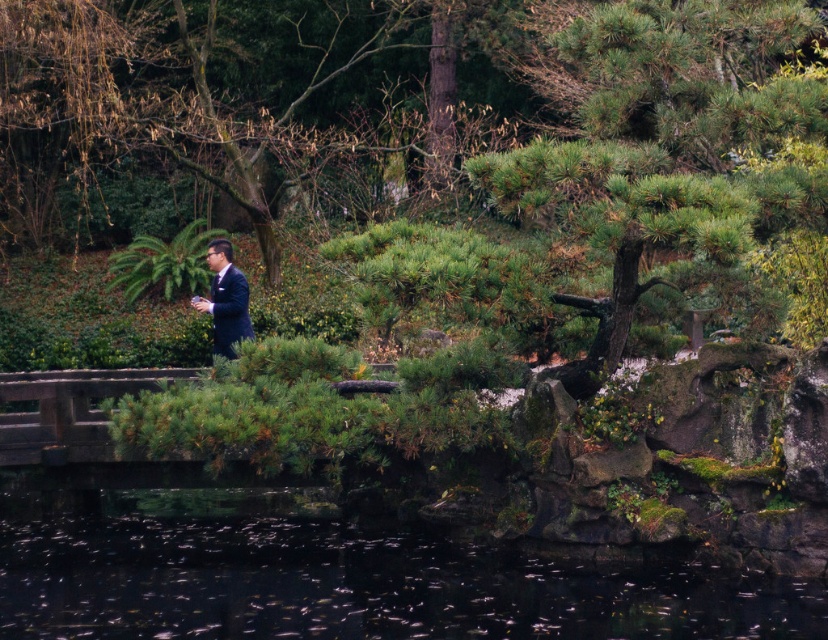
Question: Which object is farther from the camera taking this photo?

Choices:
 (A) matte black suit at center
 (B) transparent water at lower center

Answer: (A)

Question: Is the position of transparent water at lower center more distant than that of matte black suit at center?

Choices:
 (A) no
 (B) yes

Answer: (A)

Question: Is transparent water at lower center wider than matte black suit at center?

Choices:
 (A) no
 (B) yes

Answer: (B)

Question: Which object appears farthest from the camera in this image?

Choices:
 (A) transparent water at lower center
 (B) matte black suit at center

Answer: (B)

Question: Does transparent water at lower center have a larger size compared to matte black suit at center?

Choices:
 (A) yes
 (B) no

Answer: (A)